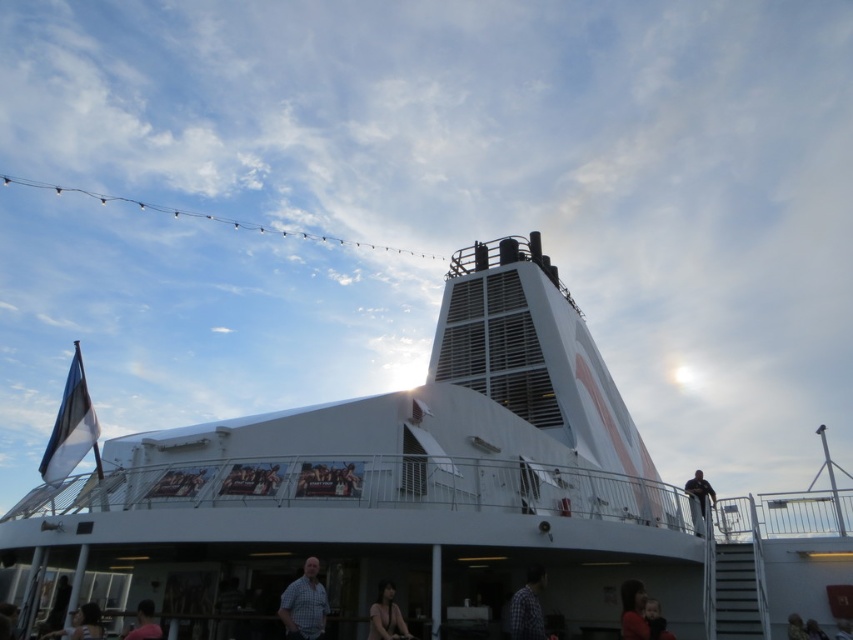
You are a photographer on the ship deck and want to capture both the matte red shirt at lower right and the dark brown hair at lower right in the same frame. Since the camera has a limited field of view, can you position yourself so that both are visible without moving either subject?

The matte red shirt at lower right is to the left of dark brown hair at lower right, so positioning the camera to include both from the left side of the matte red shirt at lower right up to the dark brown hair at lower right should capture both in the frame.